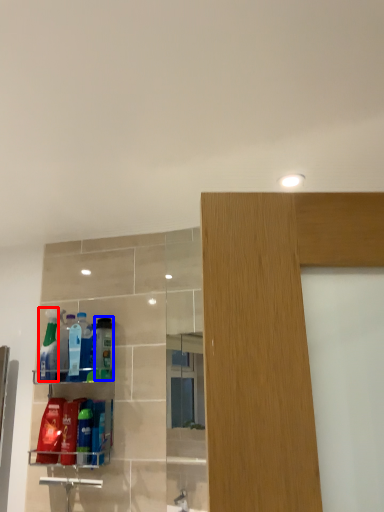
Question: Which point is closer to the camera, cleaning product (highlighted by a red box) or cleaning product (highlighted by a blue box)?

Choices:
 (A) cleaning product
 (B) cleaning product

Answer: (B)